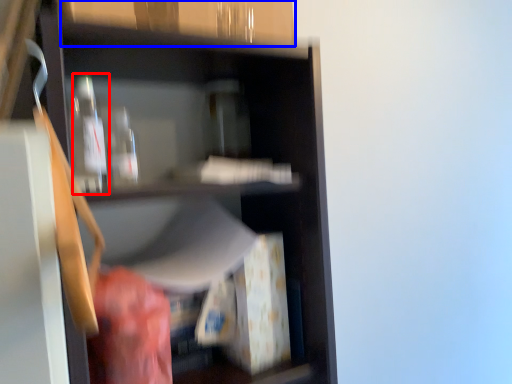
Question: Which object appears closest to the camera in this image, bottle (highlighted by a red box) or cabinetry (highlighted by a blue box)?

Choices:
 (A) bottle
 (B) cabinetry

Answer: (B)